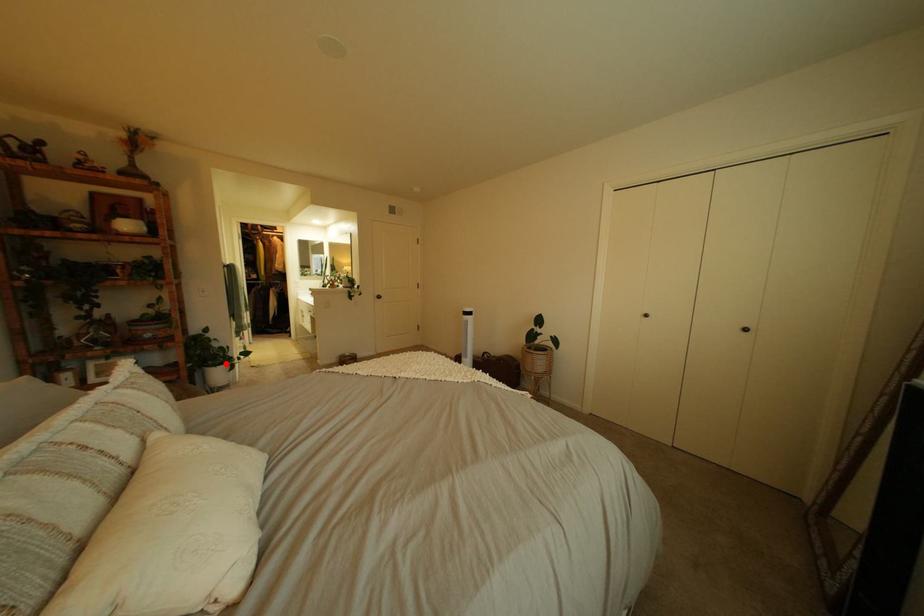
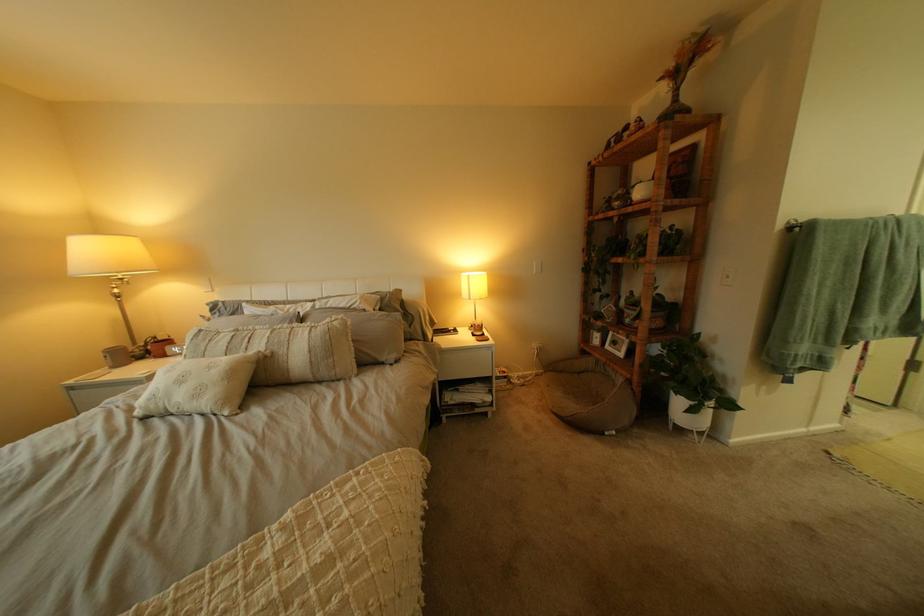
Question: I am providing you with two images of the same scene from different viewpoints. A red point is marked on the first image. Is the red point's position out of view in image 2?

Choices:
 (A) Yes
 (B) No

Answer: (B)